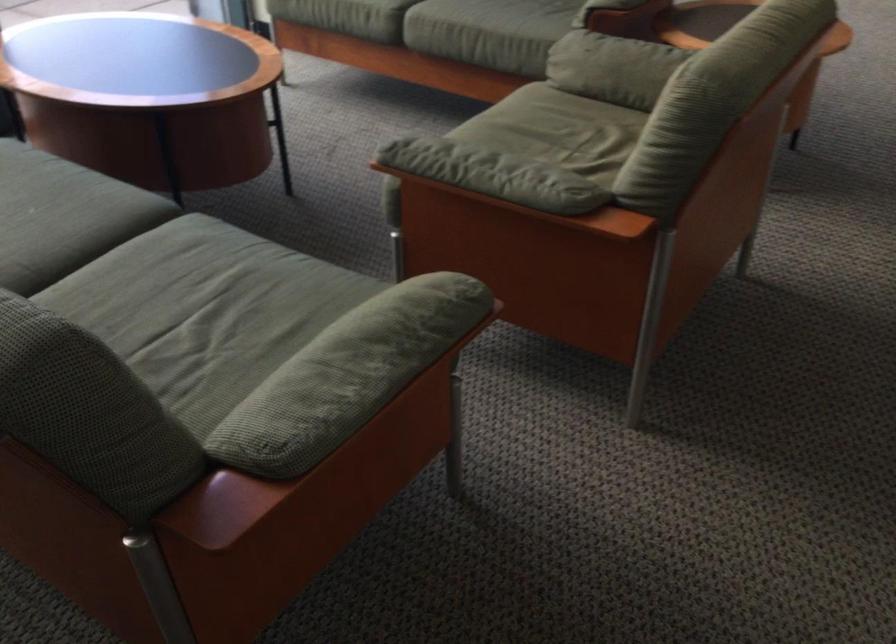
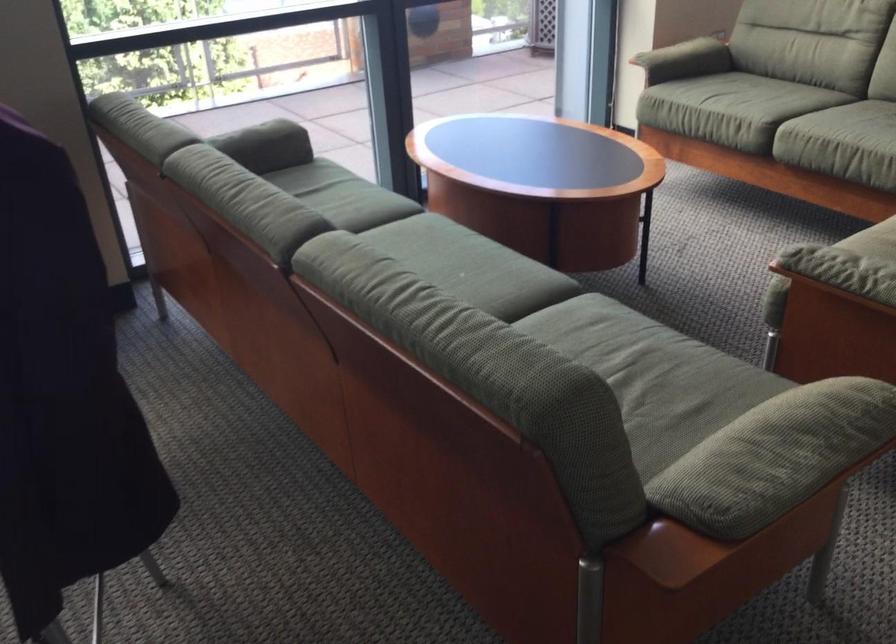
Find the pixel in the second image that matches pixel 357 370 in the first image.

(776, 456)